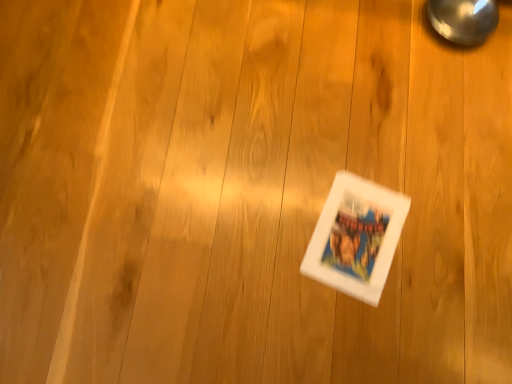
The width and height of the screenshot is (512, 384). What do you see at coordinates (356, 237) in the screenshot?
I see `white matte comic book at center` at bounding box center [356, 237].

In order to click on white matte comic book at center in this screenshot , I will do `click(356, 237)`.

Locate an element on the screen. polished metallic magnifying glass at upper right is located at coordinates (463, 19).

This screenshot has height=384, width=512. What do you see at coordinates (463, 19) in the screenshot?
I see `polished metallic magnifying glass at upper right` at bounding box center [463, 19].

In order to click on white matte comic book at center in this screenshot , I will do `click(356, 237)`.

Does polished metallic magnifying glass at upper right appear on the left side of white matte comic book at center?

No.

Relative to white matte comic book at center, is polished metallic magnifying glass at upper right in front or behind?

polished metallic magnifying glass at upper right is positioned farther from the viewer than white matte comic book at center.

Between point (466, 7) and point (377, 299), which one is positioned behind?

Point (466, 7)

From the image's perspective, which one is positioned higher, polished metallic magnifying glass at upper right or white matte comic book at center?

polished metallic magnifying glass at upper right is shown above in the image.

From a real-world perspective, relative to white matte comic book at center, is polished metallic magnifying glass at upper right vertically above or below?

In terms of real-world spatial position, polished metallic magnifying glass at upper right is above white matte comic book at center.

Between polished metallic magnifying glass at upper right and white matte comic book at center, which one has smaller width?

With smaller width is polished metallic magnifying glass at upper right.

Is polished metallic magnifying glass at upper right shorter than white matte comic book at center?

No.

Does polished metallic magnifying glass at upper right have a larger size compared to white matte comic book at center?

Correct, polished metallic magnifying glass at upper right is larger in size than white matte comic book at center.

Is white matte comic book at center completely or partially inside polished metallic magnifying glass at upper right?

No, white matte comic book at center is not inside polished metallic magnifying glass at upper right.

Are polished metallic magnifying glass at upper right and white matte comic book at center far apart?

No, polished metallic magnifying glass at upper right is in close proximity to white matte comic book at center.

Is polished metallic magnifying glass at upper right positioned with its back to white matte comic book at center?

No, white matte comic book at center is not at the back of polished metallic magnifying glass at upper right.

This screenshot has width=512, height=384. What are the coordinates of `comic book in front of the polished metallic magnifying glass at upper right` in the screenshot? It's located at (356, 237).

Based on their positions, is white matte comic book at center located to the left or right of polished metallic magnifying glass at upper right?

white matte comic book at center is positioned on polished metallic magnifying glass at upper right's left side.

In the image, is white matte comic book at center positioned in front of or behind polished metallic magnifying glass at upper right?

white matte comic book at center is in front of polished metallic magnifying glass at upper right.

Is point (362, 227) in front of point (452, 30)?

Yes, point (362, 227) is closer to viewer.

From the image's perspective, relative to polished metallic magnifying glass at upper right, is white matte comic book at center above or below?

Clearly, from the image's perspective, white matte comic book at center is below polished metallic magnifying glass at upper right.

From a real-world perspective, is white matte comic book at center under polished metallic magnifying glass at upper right?

Indeed, from a real-world perspective, white matte comic book at center is positioned beneath polished metallic magnifying glass at upper right.

In terms of width, does white matte comic book at center look wider or thinner when compared to polished metallic magnifying glass at upper right?

In the image, white matte comic book at center appears to be wider than polished metallic magnifying glass at upper right.

In terms of height, does white matte comic book at center look taller or shorter compared to polished metallic magnifying glass at upper right?

Clearly, white matte comic book at center is shorter compared to polished metallic magnifying glass at upper right.

Is white matte comic book at center bigger or smaller than polished metallic magnifying glass at upper right?

Considering their sizes, white matte comic book at center takes up less space than polished metallic magnifying glass at upper right.

In the scene shown: Is white matte comic book at center not within polished metallic magnifying glass at upper right?

Absolutely, white matte comic book at center is external to polished metallic magnifying glass at upper right.

Consider the image. Does white matte comic book at center touch polished metallic magnifying glass at upper right?

No, white matte comic book at center is not making contact with polished metallic magnifying glass at upper right.

Is white matte comic book at center oriented away from polished metallic magnifying glass at upper right?

No, white matte comic book at center's orientation is not away from polished metallic magnifying glass at upper right.

Can you tell me how much white matte comic book at center and polished metallic magnifying glass at upper right differ in facing direction?

The facing directions of white matte comic book at center and polished metallic magnifying glass at upper right are 105 degrees apart.

Based on the photo, measure the distance between white matte comic book at center and polished metallic magnifying glass at upper right.

white matte comic book at center and polished metallic magnifying glass at upper right are 26.28 inches apart from each other.

Image resolution: width=512 pixels, height=384 pixels. What are the coordinates of `comic book on the left of polished metallic magnifying glass at upper right` in the screenshot? It's located at (356, 237).

I want to click on magnifying glass lying behind the white matte comic book at center, so click(x=463, y=19).

You are a GUI agent. You are given a task and a screenshot of the screen. Output one action in this format:
    pyautogui.click(x=<x>, y=<y>)
    Task: Click on the magnifying glass to the right of white matte comic book at center
    This screenshot has width=512, height=384.
    Given the screenshot: What is the action you would take?
    pyautogui.click(x=463, y=19)